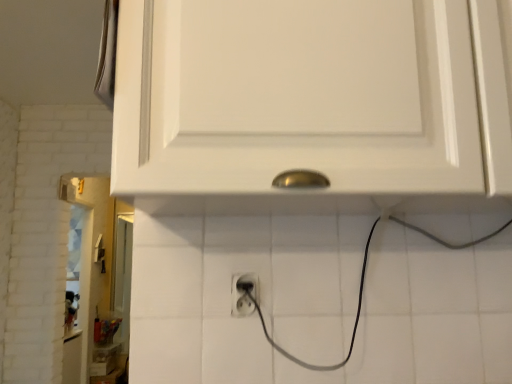
Question: Based on their positions, is black plastic power plugs and sockets at center located to the left or right of white matte cabinet at upper center?

Choices:
 (A) left
 (B) right

Answer: (A)

Question: Which is correct: black plastic power plugs and sockets at center is inside white matte cabinet at upper center, or outside of it?

Choices:
 (A) outside
 (B) inside

Answer: (A)

Question: From the image's perspective, is black plastic power plugs and sockets at center above or below white matte cabinet at upper center?

Choices:
 (A) below
 (B) above

Answer: (A)

Question: From their relative heights in the image, would you say white matte cabinet at upper center is taller or shorter than black plastic power plugs and sockets at center?

Choices:
 (A) short
 (B) tall

Answer: (B)

Question: In the image, is white matte cabinet at upper center on the left side or the right side of black plastic power plugs and sockets at center?

Choices:
 (A) left
 (B) right

Answer: (B)

Question: From the image's perspective, is white matte cabinet at upper center above or below black plastic power plugs and sockets at center?

Choices:
 (A) above
 (B) below

Answer: (A)

Question: Relative to black plastic power plugs and sockets at center, is white matte cabinet at upper center in front or behind?

Choices:
 (A) behind
 (B) front

Answer: (B)